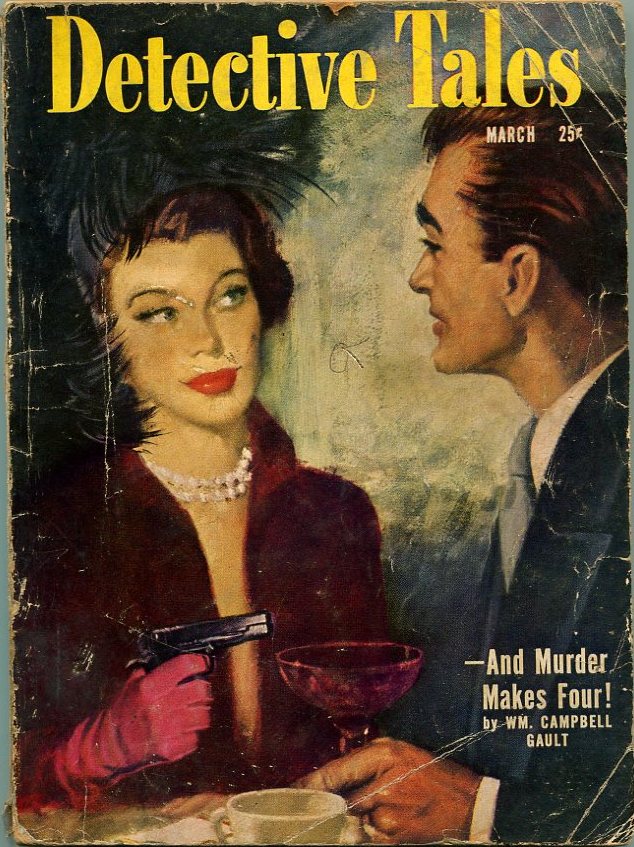
The height and width of the screenshot is (847, 634). I want to click on teacup handle, so click(x=214, y=823).